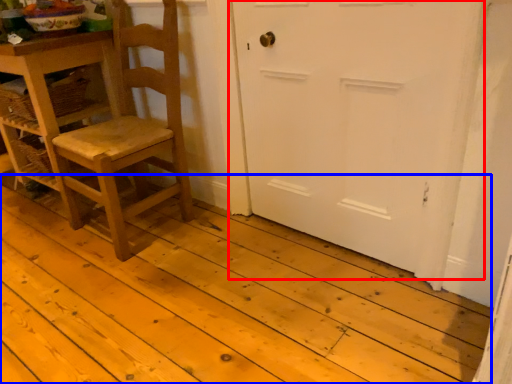
Question: Which object appears farthest to the camera in this image, door (highlighted by a red box) or plank (highlighted by a blue box)?

Choices:
 (A) door
 (B) plank

Answer: (A)